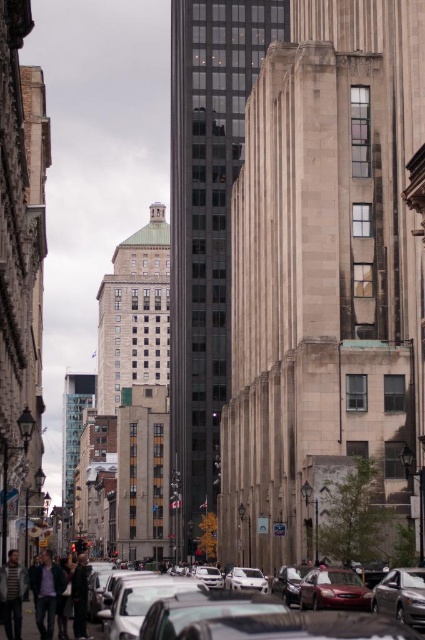
You are a pedestrian standing at the corner of the street. You see a dark gray jacket at lower left and a silver metallic car at center. Which object is wider?

The dark gray jacket at lower left is wider than the silver metallic car at center according to the description.

From the picture: You are a pedestrian standing on the sidewalk and see the shiny silver sedan at center and the dark brown leather jacket at lower center. Which object is positioned to the right of the other?

The shiny silver sedan at center is to the right of the dark brown leather jacket at lower center.

You are standing at the corner of the street looking up towards the buildings. You notice a dark gray jacket at lower left. Where exactly is the dark gray jacket located in relation to the buildings?

The dark gray jacket at lower left is located at point coordinates (47, 593), which places it near the lower left corner of the scene, close to the base of the buildings.